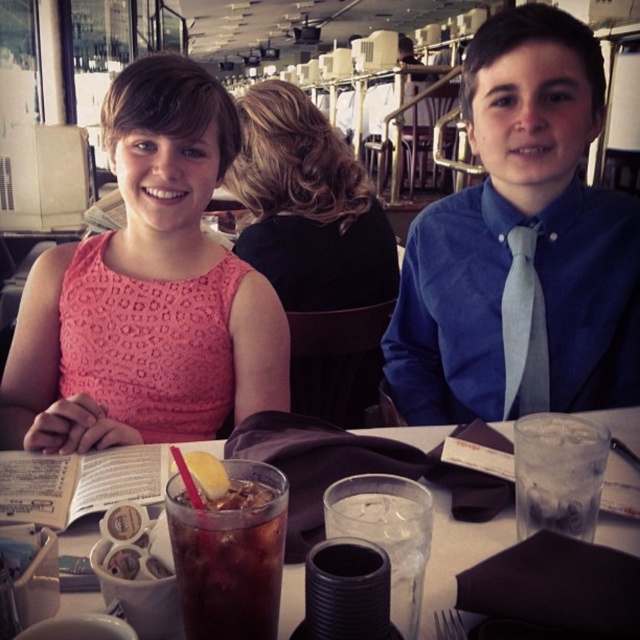
Question: Which object appears farthest from the camera in this image?

Choices:
 (A) dark brown glass at center
 (B) pink lace dress at center
 (C) blue satin shirt at center
 (D) clear plastic cup at table center

Answer: (B)

Question: Can you confirm if translucent glass at center is positioned above yellow foam at center?

Choices:
 (A) no
 (B) yes

Answer: (A)

Question: Which object appears closest to the camera in this image?

Choices:
 (A) light gray silk tie at right
 (B) blue satin shirt at center
 (C) yellow foam at center

Answer: (C)

Question: Estimate the real-world distances between objects in this image. Which object is closer to the translucent glass at center?

Choices:
 (A) pink lace dress at center
 (B) yellow foam at center
 (C) clear glass ice at table right

Answer: (C)

Question: Is the position of pink lace dress at upper left more distant than that of clear glass ice at table right?

Choices:
 (A) no
 (B) yes

Answer: (B)

Question: Does dark brown glass at center appear under yellow foam at center?

Choices:
 (A) yes
 (B) no

Answer: (A)